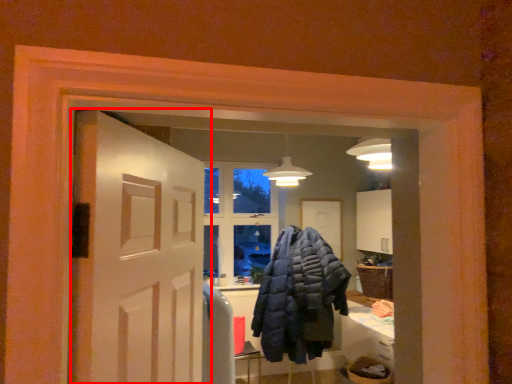
Question: In this image, where is door (annotated by the red box) located relative to jacket?

Choices:
 (A) left
 (B) right

Answer: (A)